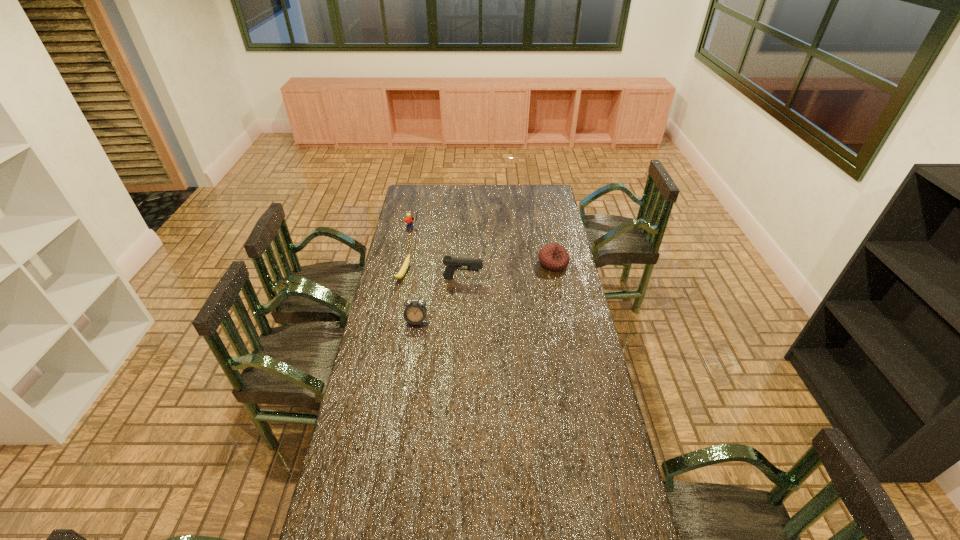
At what (x,y) coordinates should I click in order to perform the action: click on the nearest object. Please return your answer as a coordinate pair (x, y). Looking at the image, I should click on (415, 312).

At what (x,y) coordinates should I click in order to perform the action: click on alarm clock. Please return your answer as a coordinate pair (x, y). Looking at the image, I should click on (415, 312).

I want to click on the second shortest object, so click(554, 257).

The width and height of the screenshot is (960, 540). What are the coordinates of `beanbag` in the screenshot? It's located at (554, 257).

Locate an element on the screen. This screenshot has height=540, width=960. banana is located at coordinates (401, 273).

Locate an element on the screen. The image size is (960, 540). the farthest object is located at coordinates (409, 220).

Where is `the fourth object from left to right`? the fourth object from left to right is located at coordinates (452, 264).

Locate an element on the screen. This screenshot has width=960, height=540. free space located on the face of the nearest object is located at coordinates (413, 345).

You are a GUI agent. You are given a task and a screenshot of the screen. Output one action in this format:
    pyautogui.click(x=<x>, y=<y>)
    Task: Click on the vacant region located 0.060m on the back of the beanbag
    
    Given the screenshot: What is the action you would take?
    pyautogui.click(x=550, y=247)

Image resolution: width=960 pixels, height=540 pixels. Find the location of `free space located on the upward curve of the banana`. free space located on the upward curve of the banana is located at coordinates (470, 288).